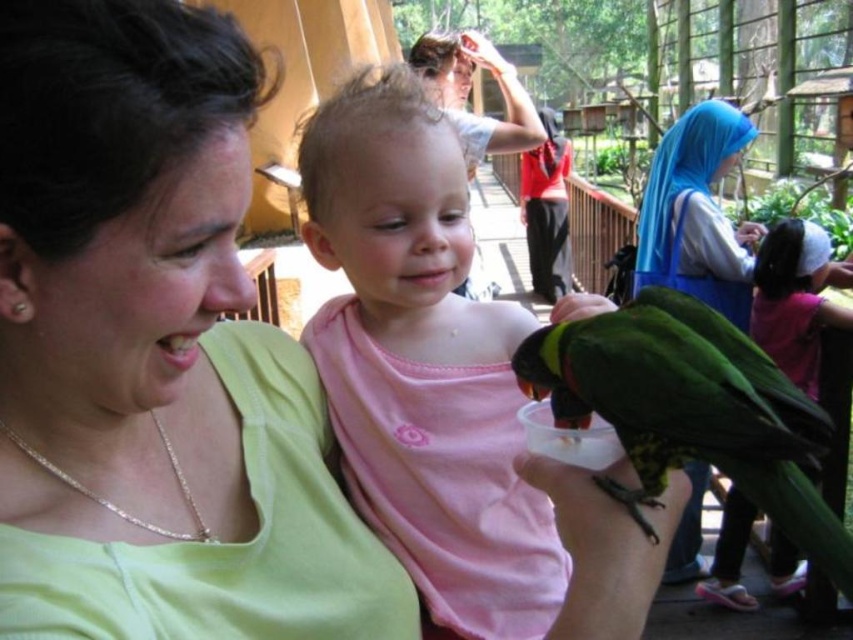
Is pink matte shirt at center to the right of green matte parrot at lower right from the viewer's perspective?

Incorrect, pink matte shirt at center is not on the right side of green matte parrot at lower right.

Measure the distance between point (412, 493) and camera.

A distance of 2.14 meters exists between point (412, 493) and camera.

Image resolution: width=853 pixels, height=640 pixels. I want to click on pink matte shirt at center, so click(424, 365).

Does green matte parrot at lower right appear on the left side of blue silk hijab at upper right?

Yes, green matte parrot at lower right is to the left of blue silk hijab at upper right.

Can you confirm if green matte parrot at lower right is wider than blue silk hijab at upper right?

No, green matte parrot at lower right is not wider than blue silk hijab at upper right.

Is point (703, 392) positioned before point (737, 140)?

Yes, point (703, 392) is closer to viewer.

Where is `green matte parrot at lower right`? The height and width of the screenshot is (640, 853). green matte parrot at lower right is located at coordinates [688, 403].

Who is higher up, pink matte shirt at center or blue silk hijab at upper right?

blue silk hijab at upper right is above.

Who is shorter, pink matte shirt at center or blue silk hijab at upper right?

Standing shorter between the two is pink matte shirt at center.

Is point (598, 300) closer to viewer compared to point (645, 253)?

Yes, it is.

At what (x,y) coordinates should I click in order to perform the action: click on pink matte shirt at center. Please return your answer as a coordinate pair (x, y). This screenshot has height=640, width=853. Looking at the image, I should click on (424, 365).